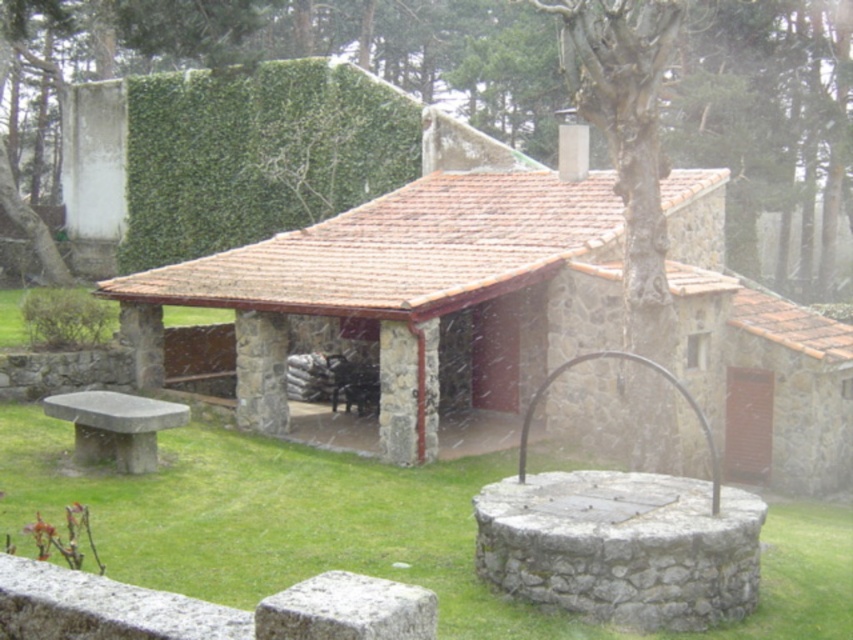
Question: Which point appears farthest from the camera in this image?

Choices:
 (A) (102, 45)
 (B) (619, 300)
 (C) (169, 404)

Answer: (A)

Question: Is green leafy tree at upper center behind green grass at lower center?

Choices:
 (A) yes
 (B) no

Answer: (A)

Question: Which point is farther to the camera?

Choices:
 (A) (134, 426)
 (B) (7, 118)
 (C) (274, 449)
 (D) (735, 429)

Answer: (B)

Question: Which object is closer to the camera taking this photo?

Choices:
 (A) green grass at lower center
 (B) stone roof hut at center
 (C) green leafy tree at upper center
 (D) smooth stone bench at lower left

Answer: (A)

Question: Does green leafy tree at upper center come in front of green grass at lower center?

Choices:
 (A) no
 (B) yes

Answer: (A)

Question: Is green grass at lower center in front of smooth stone bench at lower left?

Choices:
 (A) yes
 (B) no

Answer: (A)